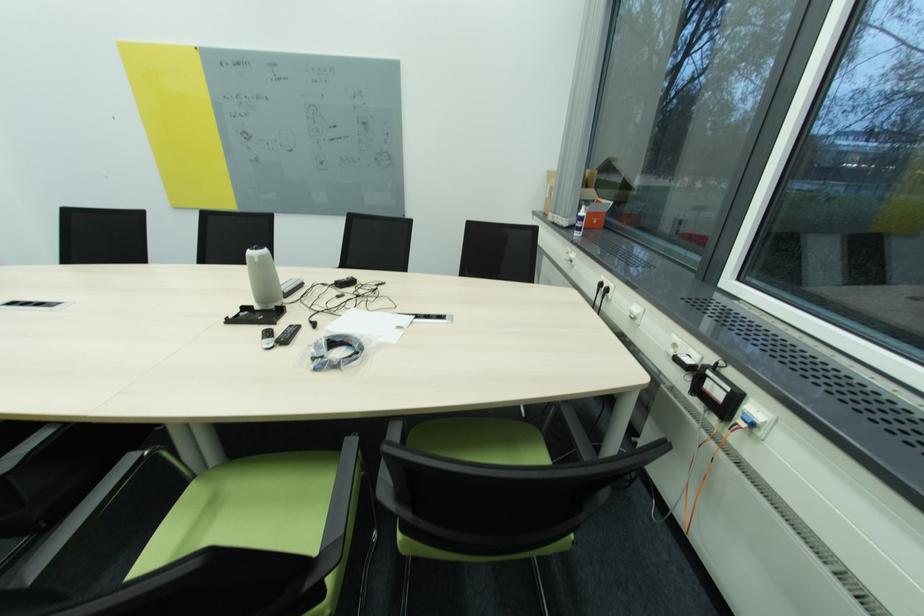
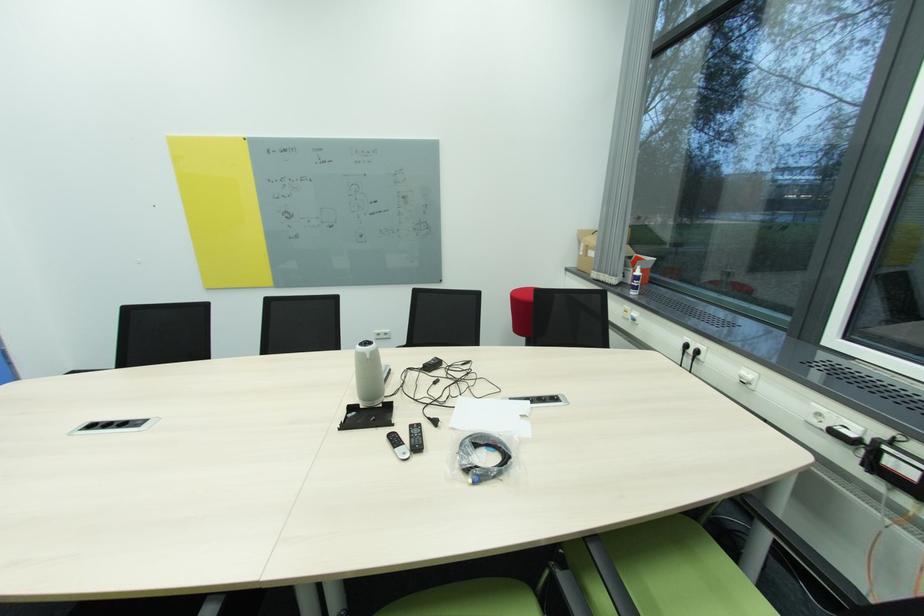
Question: The images are taken continuously from a first-person perspective. In which direction are you moving?

Choices:
 (A) Left
 (B) Right
 (C) Forward
 (D) Backward

Answer: (A)